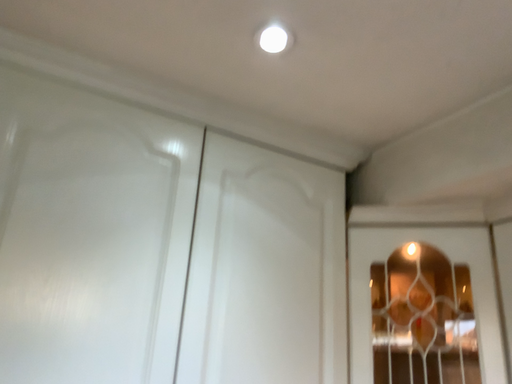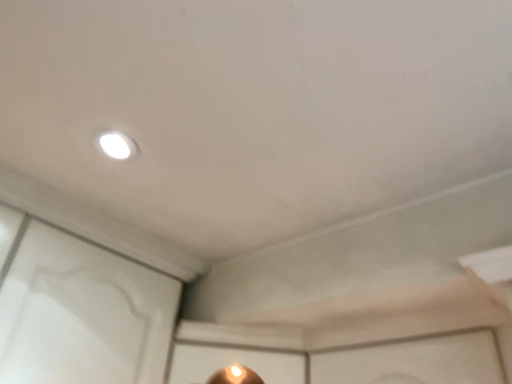
Question: How did the camera likely rotate when shooting the video?

Choices:
 (A) rotated downward
 (B) rotated upward

Answer: (B)